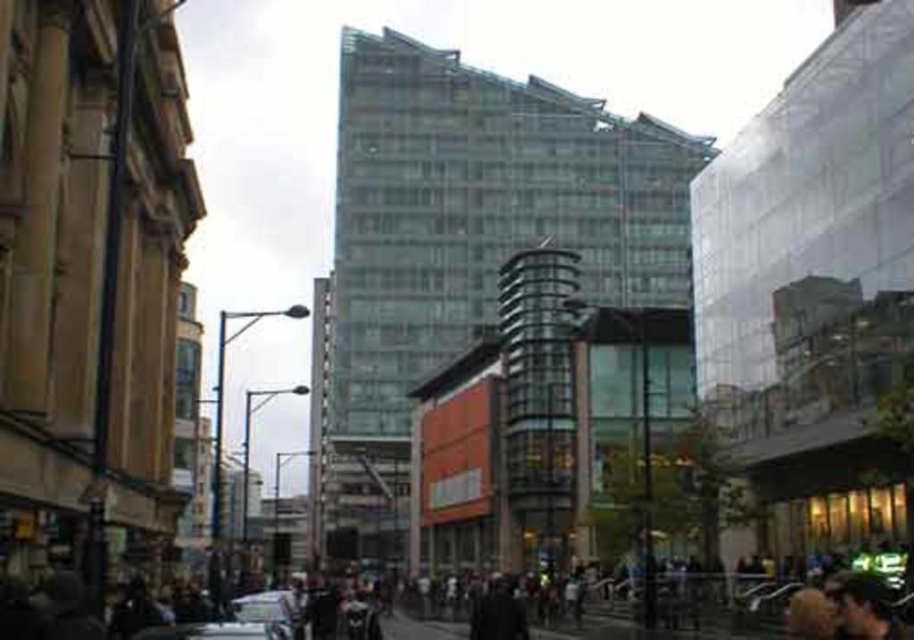
You are a delivery driver trying to park your metallic silver car at lower center between the silver metallic car at lower center and the curb. Can your car fit in the space available?

The metallic silver car at lower center is smaller than the silver metallic car at lower center. Therefore, the space between them may be sufficient for parking, but since both cars are silver metallic, it might cause confusion. Ensure there is enough space before maneuvering.